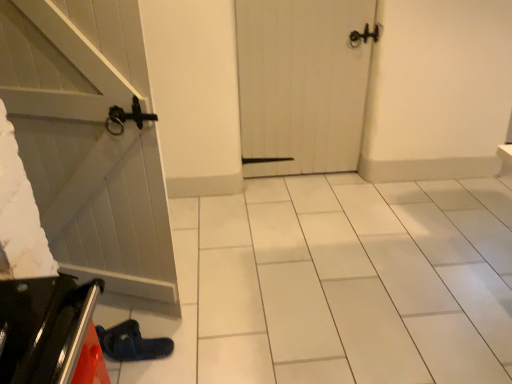
Question: From a real-world perspective, is shiny metallic oven at lower left above or below blue suede slipper at lower left?

Choices:
 (A) below
 (B) above

Answer: (B)

Question: Considering the positions of shiny metallic oven at lower left and blue suede slipper at lower left in the image, is shiny metallic oven at lower left bigger or smaller than blue suede slipper at lower left?

Choices:
 (A) small
 (B) big

Answer: (B)

Question: Which of these objects is positioned farthest from the white wooden door at center?

Choices:
 (A) shiny metallic oven at lower left
 (B) blue suede slipper at lower left

Answer: (A)

Question: Estimate the real-world distances between objects in this image. Which object is farther from the white wooden door at center?

Choices:
 (A) blue suede slipper at lower left
 (B) shiny metallic oven at lower left

Answer: (B)